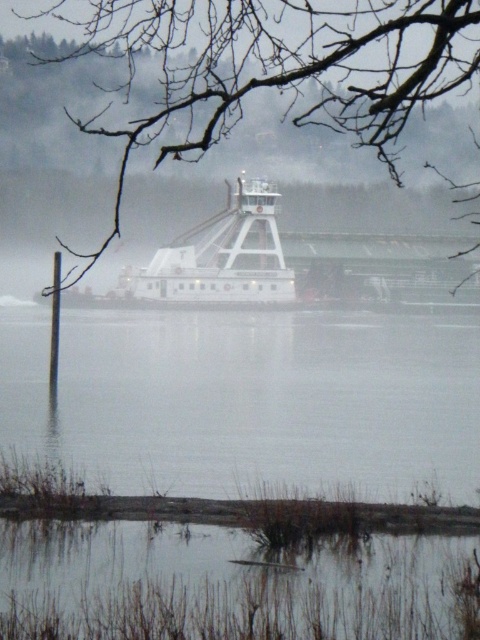
You are a photographer planning to capture the ferry boat in the mist. You notice the clear water at lower center and the bare branches at upper center in your viewfinder. Which object is positioned higher in the frame?

The bare branches at upper center are positioned higher in the frame than the clear water at lower center.

You are standing on the pier and see the clear water at lower center and the bare branches at upper center. Which object is positioned to the left of the other?

The clear water at lower center is to the left of the bare branches at upper center.